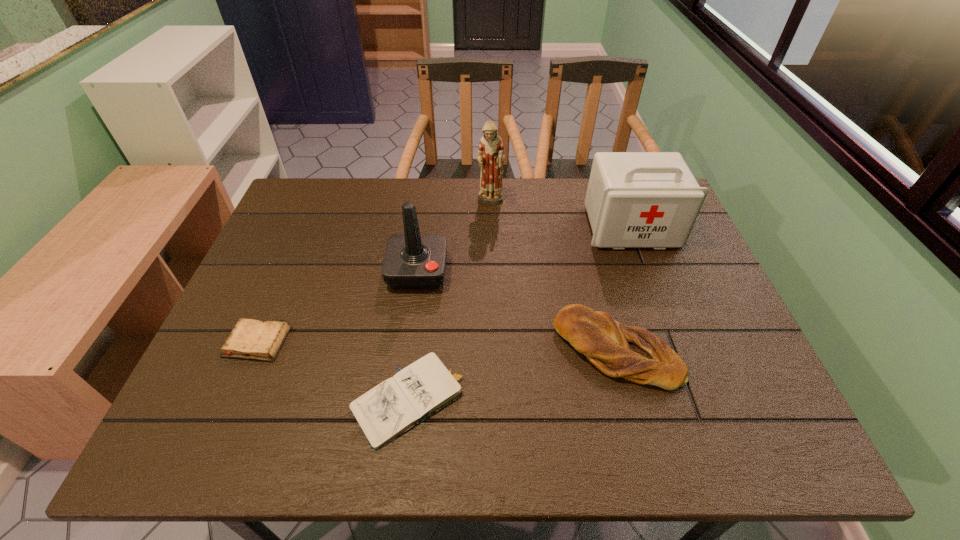
The width and height of the screenshot is (960, 540). Find the location of `the fourth object from left to right`. the fourth object from left to right is located at coordinates (491, 153).

Where is `the first-aid kit`? The height and width of the screenshot is (540, 960). the first-aid kit is located at coordinates (634, 199).

The image size is (960, 540). Find the location of `the third farthest object`. the third farthest object is located at coordinates (412, 260).

You are a GUI agent. You are given a task and a screenshot of the screen. Output one action in this format:
    pyautogui.click(x=<x>, y=<y>)
    Task: Click on the bread
    This screenshot has width=960, height=540.
    Given the screenshot: What is the action you would take?
    tap(633, 353)

Where is `the leftmost object`? the leftmost object is located at coordinates (252, 339).

I want to click on notebook, so click(397, 404).

You are a GUI agent. You are given a task and a screenshot of the screen. Output one action in this format:
    pyautogui.click(x=<x>, y=<y>)
    Task: Click on the vacant space located 0.160m on the front-facing side of the figurine
    The width and height of the screenshot is (960, 540).
    Given the screenshot: What is the action you would take?
    pyautogui.click(x=492, y=246)

The height and width of the screenshot is (540, 960). In order to click on vacant region located on the front-facing side of the first-aid kit in this screenshot , I will do coord(652,286).

You are a GUI agent. You are given a task and a screenshot of the screen. Output one action in this format:
    pyautogui.click(x=<x>, y=<y>)
    Task: Click on the free point located on the right of the joystick
    Image resolution: width=960 pixels, height=540 pixels.
    Given the screenshot: What is the action you would take?
    coord(590,272)

The image size is (960, 540). Find the location of `free region located on the back of the bread`. free region located on the back of the bread is located at coordinates (583, 220).